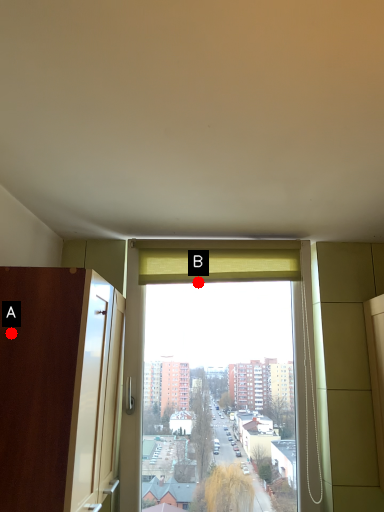
Question: Two points are circled on the image, labeled by A and B beside each circle. Which point is closer to the camera?

Choices:
 (A) A is closer
 (B) B is closer

Answer: (A)